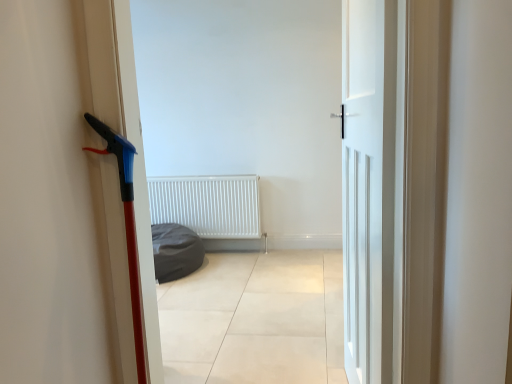
Question: Should I look upward or downward to see white matte door at center?

Choices:
 (A) up
 (B) down

Answer: (B)

Question: Is dark gray fabric beanbag at center in contact with white matte radiator at center?

Choices:
 (A) yes
 (B) no

Answer: (B)

Question: Can you confirm if dark gray fabric beanbag at center is bigger than white matte radiator at center?

Choices:
 (A) yes
 (B) no

Answer: (A)

Question: From a real-world perspective, is dark gray fabric beanbag at center below white matte radiator at center?

Choices:
 (A) no
 (B) yes

Answer: (B)

Question: Could white matte radiator at center be considered to be inside dark gray fabric beanbag at center?

Choices:
 (A) yes
 (B) no

Answer: (B)

Question: Is dark gray fabric beanbag at center far away from white matte radiator at center?

Choices:
 (A) no
 (B) yes

Answer: (A)

Question: Is dark gray fabric beanbag at center outside of white matte radiator at center?

Choices:
 (A) no
 (B) yes

Answer: (B)

Question: Does white matte radiator at center have a greater width compared to white matte door at center?

Choices:
 (A) yes
 (B) no

Answer: (A)

Question: Is white matte radiator at center further to camera compared to white matte door at center?

Choices:
 (A) no
 (B) yes

Answer: (B)

Question: Is white matte door at center completely or partially inside white matte radiator at center?

Choices:
 (A) no
 (B) yes

Answer: (A)

Question: Can you confirm if white matte radiator at center is thinner than white matte door at center?

Choices:
 (A) yes
 (B) no

Answer: (B)

Question: Would you say white matte radiator at center is a long distance from white matte door at center?

Choices:
 (A) no
 (B) yes

Answer: (B)

Question: Is white matte radiator at center positioned before white matte door at center?

Choices:
 (A) no
 (B) yes

Answer: (A)

Question: Is dark gray fabric beanbag at center next to white matte door at center?

Choices:
 (A) yes
 (B) no

Answer: (B)